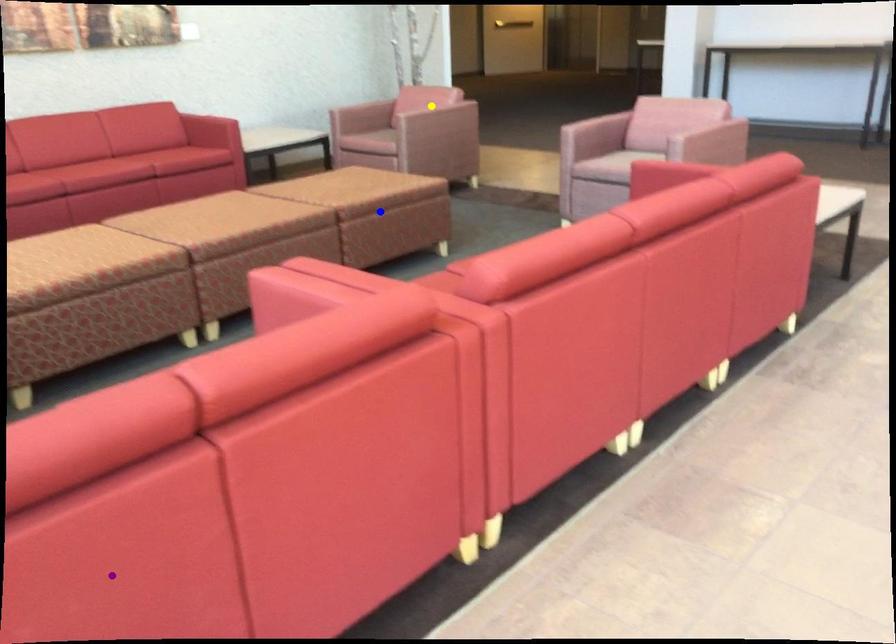
Order these from nearest to farthest:
1. yellow point
2. purple point
3. blue point

1. purple point
2. blue point
3. yellow point